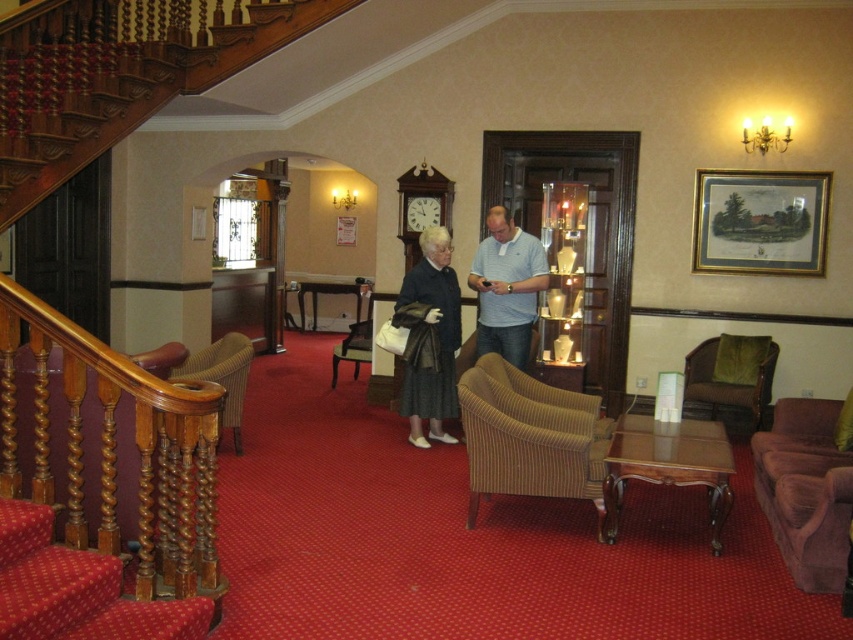
Question: Estimate the real-world distances between objects in this image. Which object is closer to the matte black dress at center?

Choices:
 (A) brown textured armchair at center
 (B) green fabric armchair at right
 (C) wooden armchair at lower left
 (D) matte black coat at center

Answer: (D)

Question: Which point appears closest to the camera in this image?

Choices:
 (A) (469, 278)
 (B) (544, 483)
 (C) (753, 372)
 (D) (225, 364)

Answer: (B)

Question: Is matte black coat at center above green fabric armchair at right?

Choices:
 (A) no
 (B) yes

Answer: (B)

Question: Is matte black dress at center bigger than velvet purple armchair at lower right?

Choices:
 (A) no
 (B) yes

Answer: (B)

Question: Which of the following is the farthest from the observer?

Choices:
 (A) matte black dress at center
 (B) green fabric armchair at right
 (C) matte black coat at center

Answer: (B)

Question: Is matte black coat at center thinner than brown textured armchair at center?

Choices:
 (A) yes
 (B) no

Answer: (A)